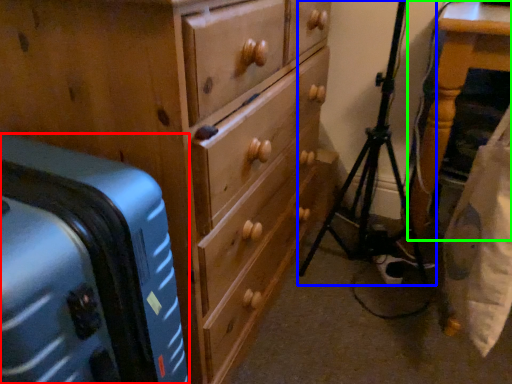
Question: Which is nearer to the suitcase (highlighted by a red box)? tripod (highlighted by a blue box) or furniture (highlighted by a green box).

Choices:
 (A) tripod
 (B) furniture

Answer: (A)